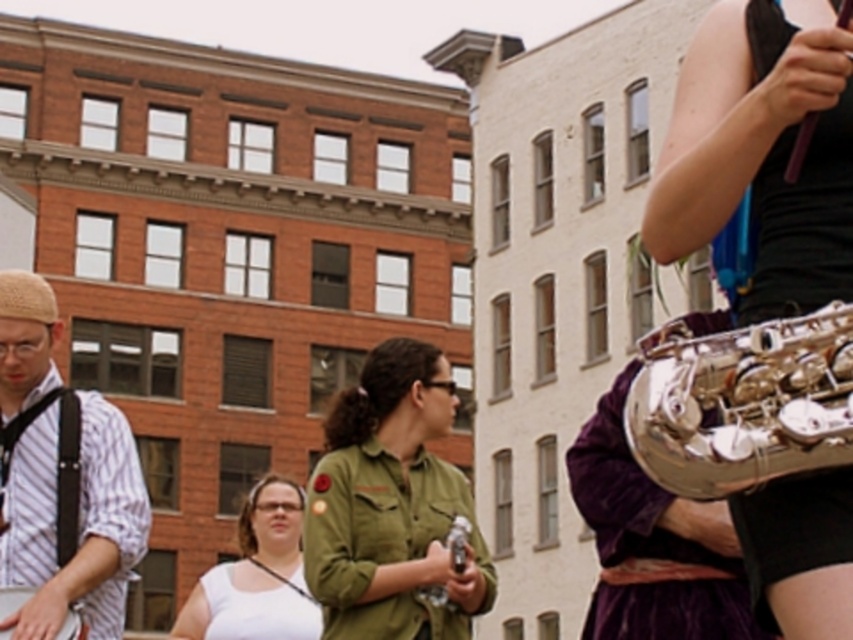
Does point (838, 125) come farther from viewer compared to point (305, 636)?

No, it is in front of (305, 636).

The height and width of the screenshot is (640, 853). I want to click on shiny silver saxophone at right, so click(x=762, y=150).

Which is in front, point (329, 540) or point (694, 388)?

Point (694, 388) is more forward.

Can you confirm if green matte shirt at center is positioned to the left of silver polished trumpet at right?

Indeed, green matte shirt at center is positioned on the left side of silver polished trumpet at right.

The height and width of the screenshot is (640, 853). I want to click on green matte shirt at center, so click(392, 504).

Does striped cotton shirt at left come in front of white matte dress at center?

Yes.

Between striped cotton shirt at left and white matte dress at center, which one appears on the right side from the viewer's perspective?

striped cotton shirt at left

Does point (0, 561) come behind point (218, 589)?

No, (0, 561) is closer to viewer.

This screenshot has width=853, height=640. In order to click on striped cotton shirt at left in this screenshot , I will do `click(78, 522)`.